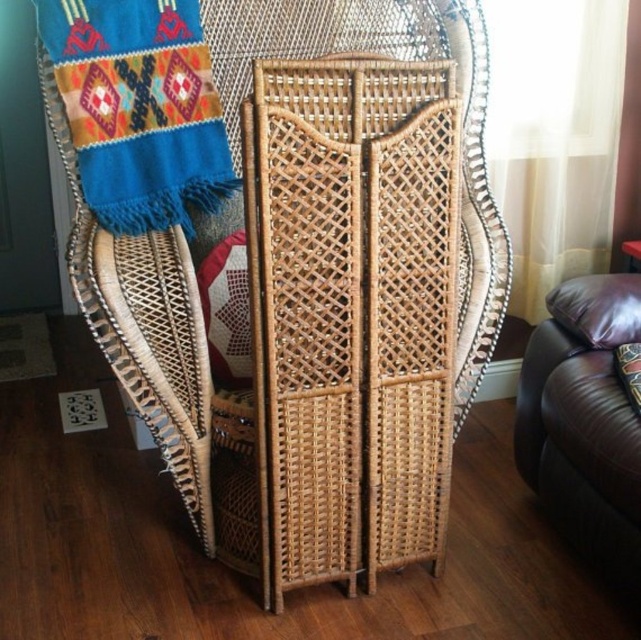
Does leather cushion at right appear over leather cushion at lower right?

Correct, leather cushion at right is located above leather cushion at lower right.

Based on the photo, is leather cushion at right bigger than leather cushion at lower right?

Correct, leather cushion at right is larger in size than leather cushion at lower right.

Image resolution: width=641 pixels, height=640 pixels. Find the location of `leather cushion at right`. leather cushion at right is located at coordinates (597, 308).

In the scene shown: Which of these two, translucent fabric curtain at upper right or brown leather couch at lower right, stands shorter?

Standing shorter between the two is brown leather couch at lower right.

Between translucent fabric curtain at upper right and brown leather couch at lower right, which one appears on the left side from the viewer's perspective?

brown leather couch at lower right is more to the left.

Locate an element on the screen. The image size is (641, 640). translucent fabric curtain at upper right is located at coordinates (554, 134).

You are a GUI agent. You are given a task and a screenshot of the screen. Output one action in this format:
    pyautogui.click(x=<x>, y=<y>)
    Task: Click on the translucent fabric curtain at upper right
    The width and height of the screenshot is (641, 640).
    Given the screenshot: What is the action you would take?
    pyautogui.click(x=554, y=134)

Is natural woven wood armchair at center thinner than leather cushion at right?

Incorrect, natural woven wood armchair at center's width is not less than leather cushion at right's.

Is natural woven wood armchair at center bigger than leather cushion at right?

Yes.

Identify the location of natural woven wood armchair at center. Image resolution: width=641 pixels, height=640 pixels. (294, 260).